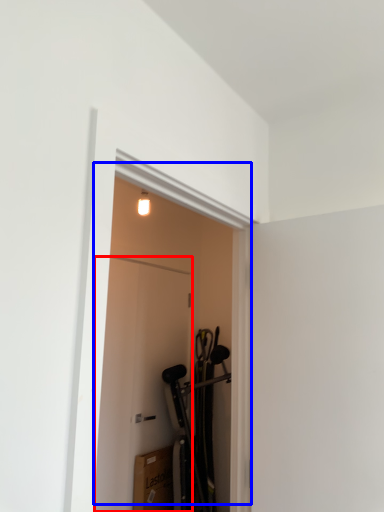
Question: Among these objects, which one is farthest to the camera, door (highlighted by a red box) or door (highlighted by a blue box)?

Choices:
 (A) door
 (B) door

Answer: (A)